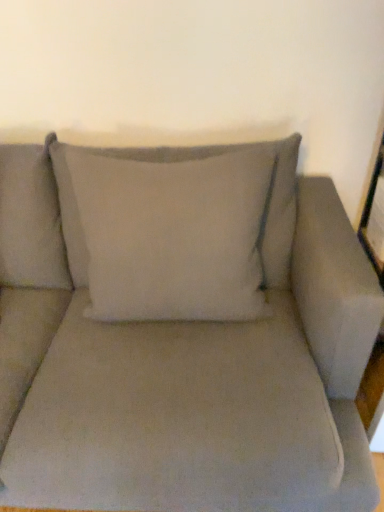
Image resolution: width=384 pixels, height=512 pixels. Describe the element at coordinates (181, 332) in the screenshot. I see `matte gray couch at center` at that location.

Measure the distance between matte gray couch at center and camera.

matte gray couch at center is 39.14 inches away from camera.

What is the approximate width of matte gray couch at center?

It is 3.45 feet.

Find the location of a particular element. This screenshot has height=512, width=384. matte gray couch at center is located at coordinates (181, 332).

What do you see at coordinates (165, 234) in the screenshot? The width and height of the screenshot is (384, 512). I see `white cotton pillow at center` at bounding box center [165, 234].

Measure the distance between white cotton pillow at center and camera.

white cotton pillow at center and camera are 1.19 meters apart.

Locate an element on the screen. The height and width of the screenshot is (512, 384). white cotton pillow at center is located at coordinates (165, 234).

Locate an element on the screen. Image resolution: width=384 pixels, height=512 pixels. matte gray couch at center is located at coordinates (181, 332).

Considering the positions of objects white cotton pillow at center and matte gray couch at center in the image provided, who is more to the left, white cotton pillow at center or matte gray couch at center?

matte gray couch at center.

Considering their positions, is white cotton pillow at center located in front of or behind matte gray couch at center?

white cotton pillow at center is positioned farther from the viewer than matte gray couch at center.

Is point (121, 271) farther from viewer compared to point (297, 189)?

No.

From the image's perspective, between white cotton pillow at center and matte gray couch at center, who is located below?

matte gray couch at center appears lower in the image.

From a real-world perspective, which is physically above, white cotton pillow at center or matte gray couch at center?

white cotton pillow at center.

Which of these two, white cotton pillow at center or matte gray couch at center, is thinner?

With smaller width is white cotton pillow at center.

Which of these two, white cotton pillow at center or matte gray couch at center, stands shorter?

white cotton pillow at center.

Considering the sizes of objects white cotton pillow at center and matte gray couch at center in the image provided, who is smaller, white cotton pillow at center or matte gray couch at center?

Smaller between the two is white cotton pillow at center.

Does white cotton pillow at center contain matte gray couch at center?

No, matte gray couch at center is not inside white cotton pillow at center.

Is white cotton pillow at center not near matte gray couch at center?

No, there isn't a large distance between white cotton pillow at center and matte gray couch at center.

Is white cotton pillow at center aimed at matte gray couch at center?

Yes, white cotton pillow at center is facing matte gray couch at center.

The width and height of the screenshot is (384, 512). In the image, there is a matte gray couch at center. What are the coordinates of `pillow above it (from the image's perspective)` in the screenshot? It's located at (165, 234).

Considering the positions of objects matte gray couch at center and white cotton pillow at center in the image provided, who is more to the right, matte gray couch at center or white cotton pillow at center?

Positioned to the right is white cotton pillow at center.

Is matte gray couch at center positioned before white cotton pillow at center?

That is True.

Is point (221, 291) closer or farther from the camera than point (196, 293)?

Point (221, 291) is positioned closer to the camera compared to point (196, 293).

From the image's perspective, does matte gray couch at center appear higher than white cotton pillow at center?

Incorrect, from the image's perspective, matte gray couch at center is lower than white cotton pillow at center.

In the scene shown: From a real-world perspective, which is physically above, matte gray couch at center or white cotton pillow at center?

white cotton pillow at center, from a real-world perspective.

Considering the sizes of objects matte gray couch at center and white cotton pillow at center in the image provided, who is thinner, matte gray couch at center or white cotton pillow at center?

Thinner between the two is white cotton pillow at center.

Considering the sizes of objects matte gray couch at center and white cotton pillow at center in the image provided, who is taller, matte gray couch at center or white cotton pillow at center?

Standing taller between the two is matte gray couch at center.

Is matte gray couch at center smaller than white cotton pillow at center?

No.

Would you say matte gray couch at center contains white cotton pillow at center?

Yes.

Is matte gray couch at center touching white cotton pillow at center?

There is a gap between matte gray couch at center and white cotton pillow at center.

Is matte gray couch at center positioned with its back to white cotton pillow at center?

Yes, white cotton pillow at center is at the back of matte gray couch at center.

How many degrees apart are the facing directions of matte gray couch at center and white cotton pillow at center?

matte gray couch at center and white cotton pillow at center are facing 0.401 degrees away from each other.

Find the location of `pillow above the matte gray couch at center (from the image's perspective)`. pillow above the matte gray couch at center (from the image's perspective) is located at coordinates (165, 234).

In the image, there is a white cotton pillow at center. Identify the location of studio couch below it (from a real-world perspective). tap(181, 332).

Identify the location of pillow lying above the matte gray couch at center (from the image's perspective). (165, 234).